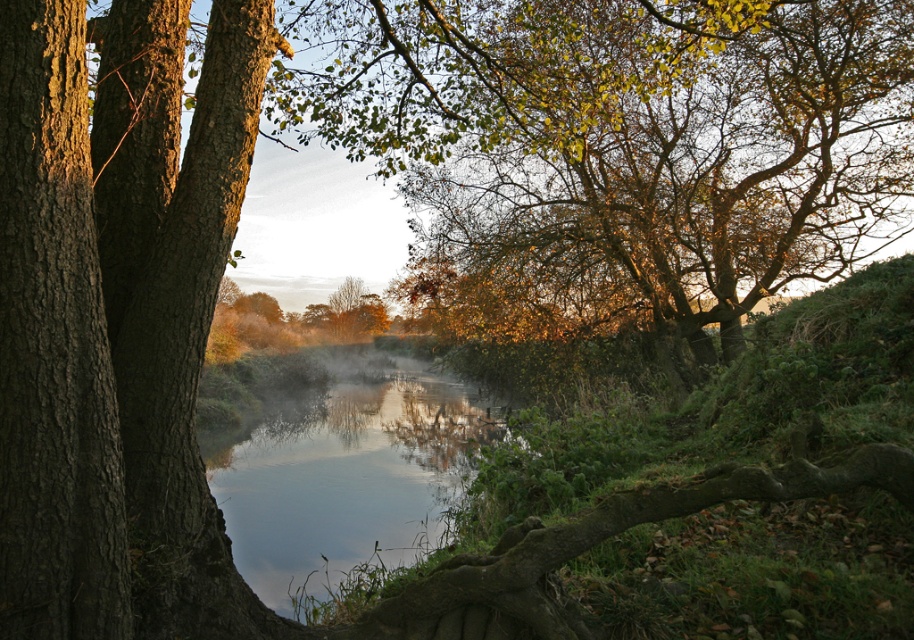
You are standing at the point with coordinates point (267,536) in the scene. You want to reach the point (537,221). Is there any obstruction between you and your destination?

Point (537,221) is behind point (267,536), so there is an obstruction between you and the destination.